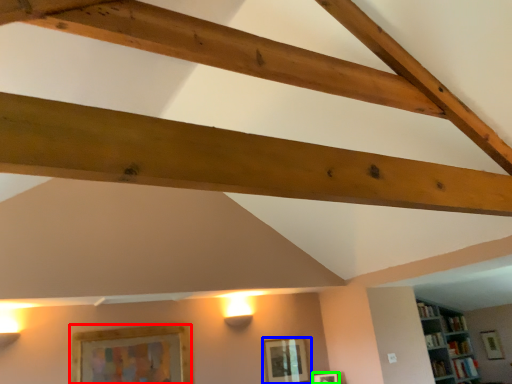
Question: Which object is positioned closest to picture frame (highlighted by a red box)? Select from picture frame (highlighted by a blue box) and picture frame (highlighted by a green box).

Choices:
 (A) picture frame
 (B) picture frame

Answer: (A)